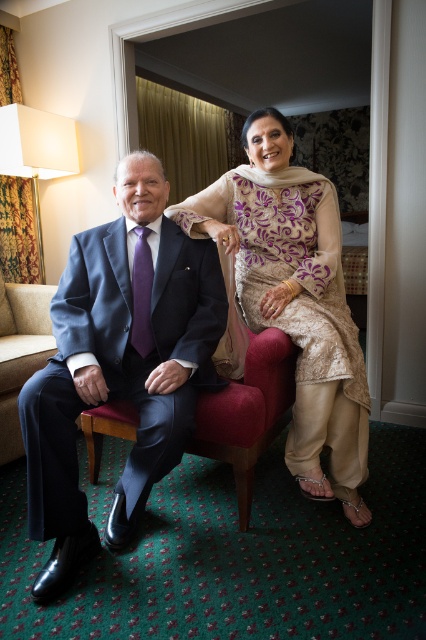
In the scene shown: You are a photographer setting up for a photoshoot in a room with a beige lace dress at center and a suede couch at lower left. You need to position a large backdrop that must be wider than the widest object in the scene. Which object should you measure to ensure the backdrop is wide enough?

The beige lace dress at center is wider than the suede couch at lower left, so you should measure the beige lace dress at center to ensure the backdrop is wide enough.